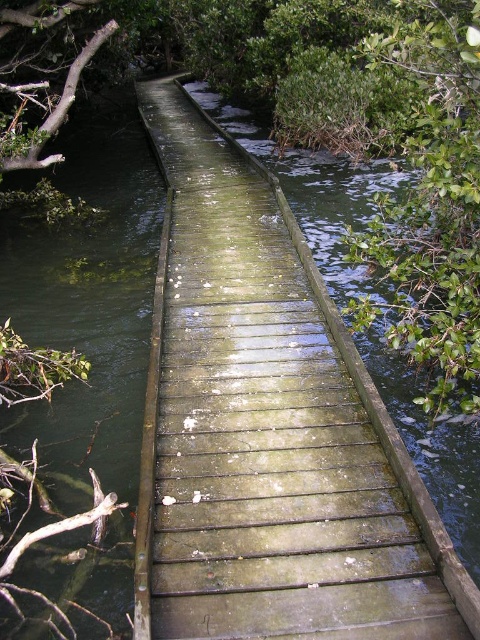
You are a nature photographer aiming to capture the boardwalk and its surroundings. You notice the green mossy wood at center and the green leafy branch at upper left in your viewfinder. Which object would occupy more space in your photo if both are framed similarly?

The green mossy wood at center has a larger size compared to the green leafy branch at upper left, so it would occupy more space in the photo.

You are a hiker walking along the boardwalk and need to cross to the other side. You notice the green mossy wood at center and the green leafy tree at right. Which object is wider when viewed from above?

The green mossy wood at center is wider than the green leafy tree at right.

You are a park ranger inspecting the boardwalk. You notice the green mossy wood at center and the green leafy branch at upper left. Which object has a greater width?

The green mossy wood at center might be wider than green leafy branch at upper left.